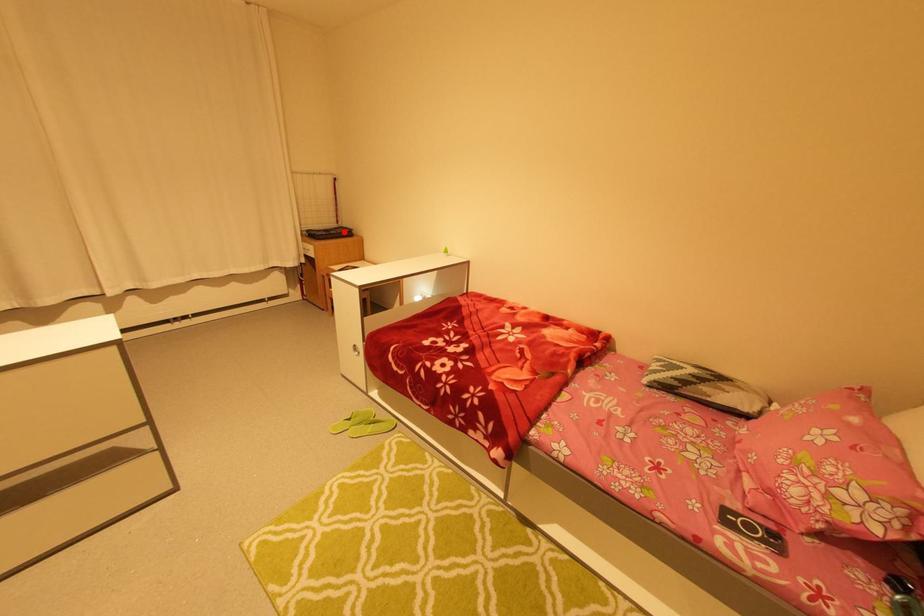
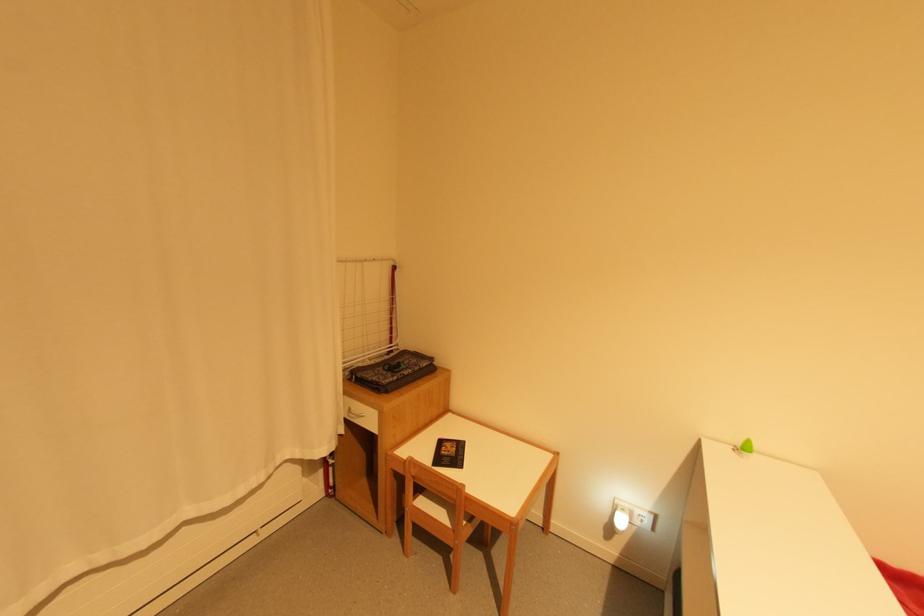
Find the pixel in the second image that matches the highlighted location in the first image.

(421, 369)